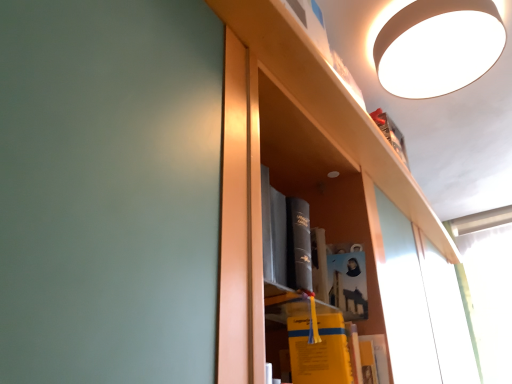
Question: In which direction should I rotate to look at matte paper book at center, marked as the second book in a bottom-to-top arrangement?

Choices:
 (A) right
 (B) left

Answer: (A)

Question: From a real-world perspective, is white matte lampshade at upper right over matte paper book at center, which is the first book from top to bottom?

Choices:
 (A) yes
 (B) no

Answer: (A)

Question: Is white matte lampshade at upper right not close to matte paper book at center, which is the first book from top to bottom?

Choices:
 (A) no
 (B) yes

Answer: (A)

Question: Is white matte lampshade at upper right thinner than matte paper book at center, which is the first book from top to bottom?

Choices:
 (A) yes
 (B) no

Answer: (B)

Question: Is white matte lampshade at upper right shorter than matte paper book at center, which is the first book from top to bottom?

Choices:
 (A) no
 (B) yes

Answer: (B)

Question: Is white matte lampshade at upper right completely or partially outside of matte paper book at center, which is the first book from top to bottom?

Choices:
 (A) no
 (B) yes

Answer: (B)

Question: From the image's perspective, is white matte lampshade at upper right located beneath matte paper book at center, marked as the second book in a bottom-to-top arrangement?

Choices:
 (A) no
 (B) yes

Answer: (A)

Question: Is white matte lampshade at upper right shorter than yellow matte book at center, which is the 2th book from top to bottom?

Choices:
 (A) yes
 (B) no

Answer: (A)

Question: From a real-world perspective, does white matte lampshade at upper right stand above yellow matte book at center, which is the 2th book from top to bottom?

Choices:
 (A) no
 (B) yes

Answer: (B)

Question: Is white matte lampshade at upper right oriented away from yellow matte book at center, the 1th book in the bottom-to-top sequence?

Choices:
 (A) yes
 (B) no

Answer: (B)

Question: From a real-world perspective, is white matte lampshade at upper right under yellow matte book at center, the 1th book in the bottom-to-top sequence?

Choices:
 (A) yes
 (B) no

Answer: (B)

Question: Is white matte lampshade at upper right in front of yellow matte book at center, the 1th book in the bottom-to-top sequence?

Choices:
 (A) yes
 (B) no

Answer: (B)

Question: Considering the relative positions of white matte lampshade at upper right and yellow matte book at center, which is the 2th book from top to bottom, in the image provided, is white matte lampshade at upper right to the right of yellow matte book at center, which is the 2th book from top to bottom, from the viewer's perspective?

Choices:
 (A) no
 (B) yes

Answer: (B)

Question: Considering the relative sizes of matte paper book at center, which is the first book from top to bottom, and white matte lampshade at upper right in the image provided, is matte paper book at center, which is the first book from top to bottom, bigger than white matte lampshade at upper right?

Choices:
 (A) no
 (B) yes

Answer: (A)